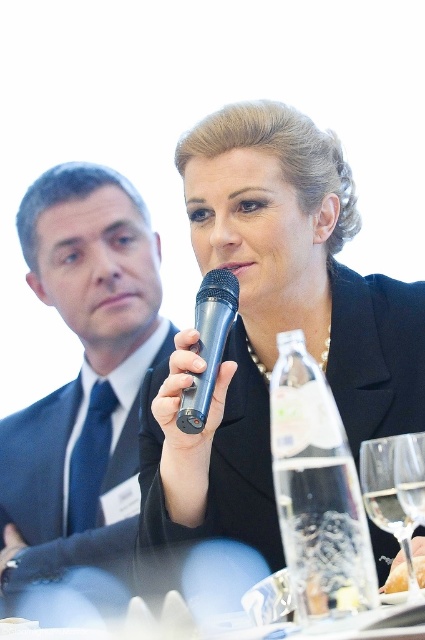
You are organizing a formal event and need to arrange seating so that the dark blue suit at left and the transparent glass wine glass at center are visible to all attendees. Considering their heights, which object should be placed closer to the front to ensure visibility?

The dark blue suit at left is taller than the transparent glass wine glass at center, so placing the dark blue suit at left closer to the front will ensure that both objects are visible to all attendees without one blocking the other.

In the scene shown: You are an event planner trying to arrange seating for a panel discussion. You see the dark blue suit at left and the metallic blue microphone at center. Which object is positioned closer to the bottom of the image?

The dark blue suit at left is positioned below the metallic blue microphone at center, so it is closer to the bottom of the image.